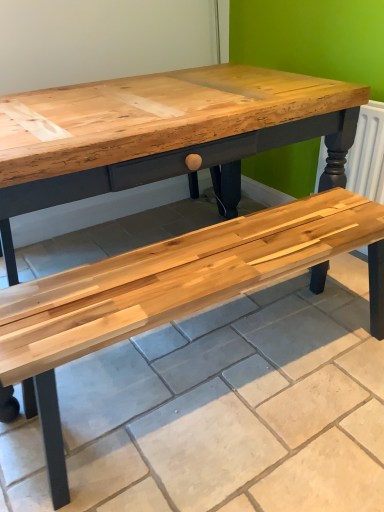
Locate an element on the screen. vacant space situated above natural wood bench at lower center (from a real-world perspective) is located at coordinates (243, 357).